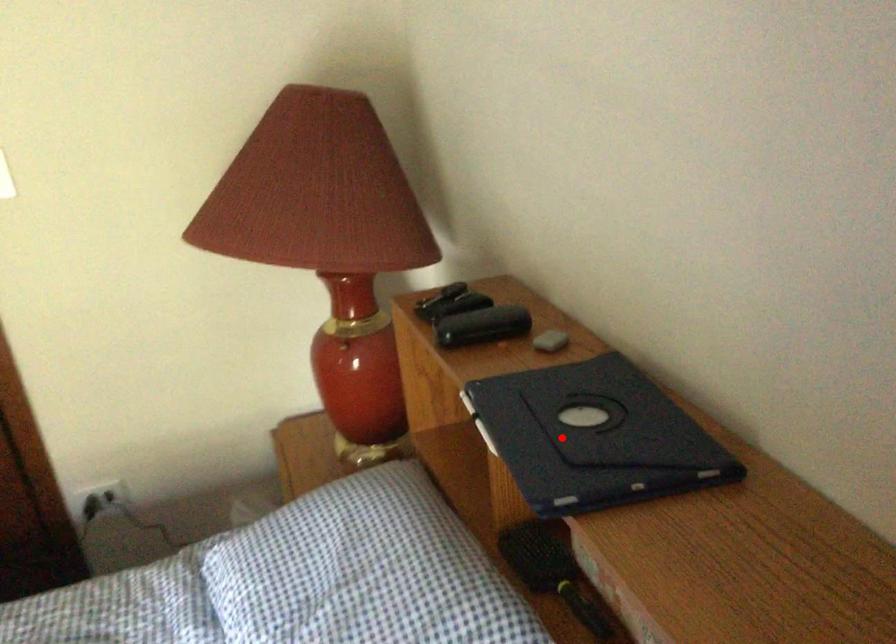
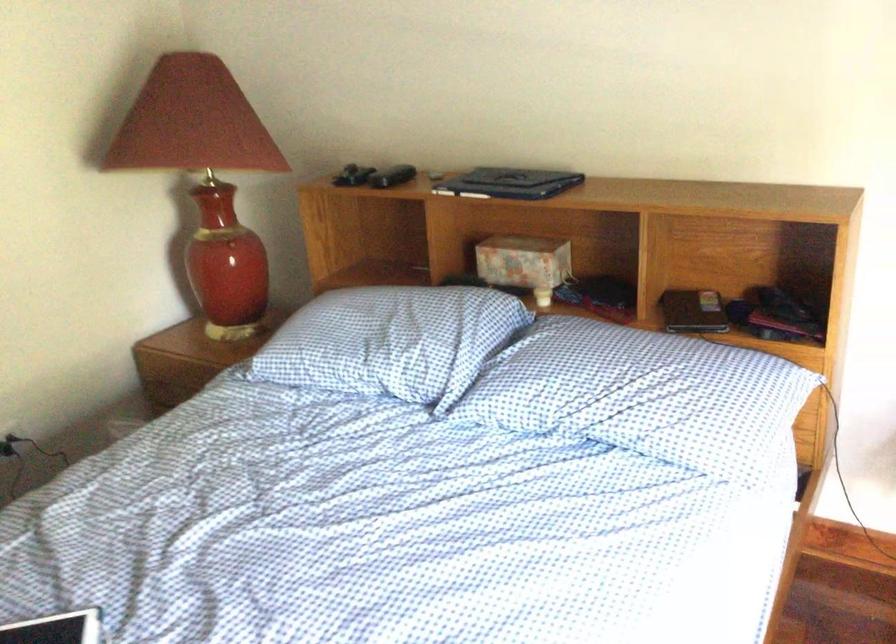
Find the pixel in the second image that matches the highlighted location in the first image.

(510, 183)